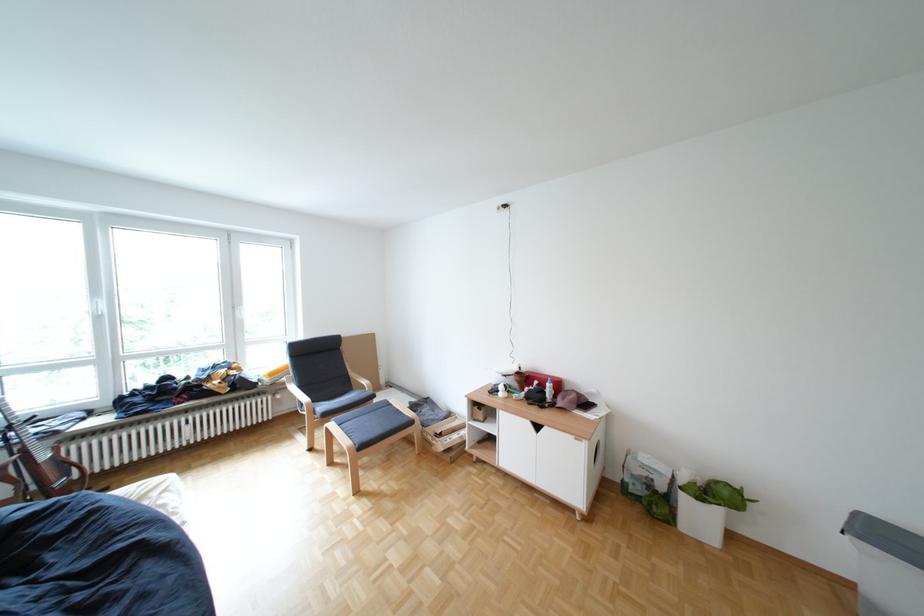
What do you see at coordinates (386, 395) in the screenshot?
I see `the chair sitting surface` at bounding box center [386, 395].